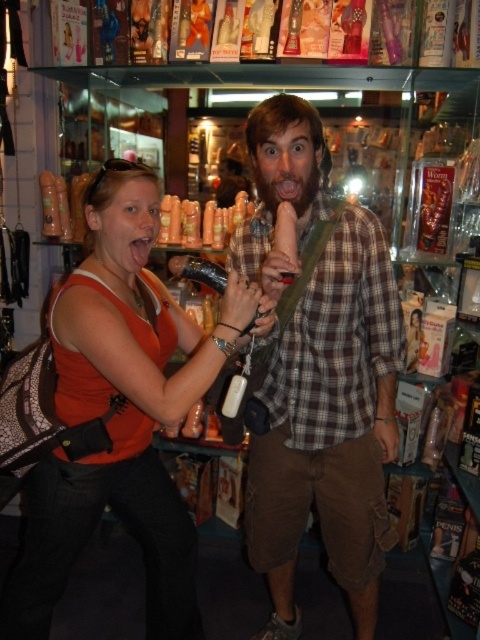
Question: Considering the relative positions of orange matte tank top at center and brown fuzzy beard at center in the image provided, where is orange matte tank top at center located with respect to brown fuzzy beard at center?

Choices:
 (A) left
 (B) right

Answer: (A)

Question: Considering the relative positions of plaid fabric shirt at center and orange matte tank top at center in the image provided, where is plaid fabric shirt at center located with respect to orange matte tank top at center?

Choices:
 (A) left
 (B) right

Answer: (B)

Question: Among these objects, which one is farthest from the camera?

Choices:
 (A) orange matte tank top at center
 (B) brown fuzzy beard at center

Answer: (B)

Question: Which object appears closest to the camera in this image?

Choices:
 (A) plaid fabric shirt at center
 (B) orange matte tank top at center

Answer: (B)

Question: Can you confirm if plaid fabric shirt at center is wider than brown fuzzy beard at center?

Choices:
 (A) yes
 (B) no

Answer: (A)

Question: Which of the following is the closest to the observer?

Choices:
 (A) (x=273, y=321)
 (B) (x=316, y=177)
 (C) (x=358, y=269)

Answer: (A)